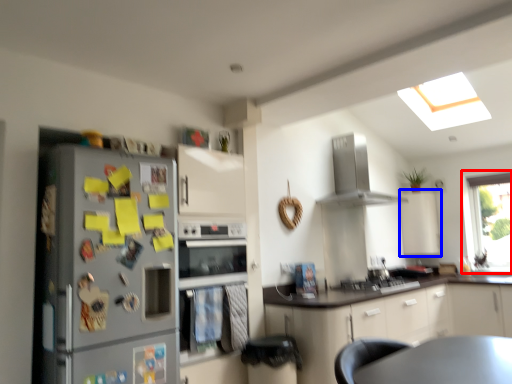
Question: Among these objects, which one is farthest to the camera, window (highlighted by a red box) or cabinetry (highlighted by a blue box)?

Choices:
 (A) window
 (B) cabinetry

Answer: (B)